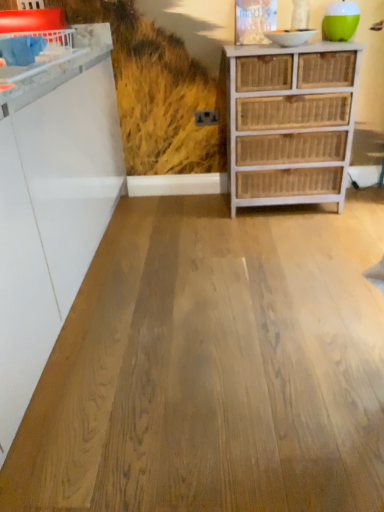
Question: Is white glossy counter at upper left directly adjacent to white wicker chest of drawers at right?

Choices:
 (A) no
 (B) yes

Answer: (A)

Question: Does white glossy counter at upper left come behind white wicker chest of drawers at right?

Choices:
 (A) no
 (B) yes

Answer: (A)

Question: From a real-world perspective, is white glossy counter at upper left physically below white wicker chest of drawers at right?

Choices:
 (A) no
 (B) yes

Answer: (A)

Question: Considering the relative sizes of white glossy counter at upper left and white wicker chest of drawers at right in the image provided, is white glossy counter at upper left smaller than white wicker chest of drawers at right?

Choices:
 (A) yes
 (B) no

Answer: (A)

Question: Could you tell me if white glossy counter at upper left is turned towards white wicker chest of drawers at right?

Choices:
 (A) yes
 (B) no

Answer: (B)

Question: From a real-world perspective, relative to white wicker chest of drawers at right, is natural wood floor at center vertically above or below?

Choices:
 (A) above
 (B) below

Answer: (B)

Question: Considering the positions of natural wood floor at center and white wicker chest of drawers at right in the image, is natural wood floor at center bigger or smaller than white wicker chest of drawers at right?

Choices:
 (A) small
 (B) big

Answer: (A)

Question: From their relative heights in the image, would you say natural wood floor at center is taller or shorter than white wicker chest of drawers at right?

Choices:
 (A) short
 (B) tall

Answer: (A)

Question: Is natural wood floor at center in front of or behind white wicker chest of drawers at right in the image?

Choices:
 (A) behind
 (B) front

Answer: (B)

Question: Considering the positions of white wicker chest of drawers at right and natural wood floor at center in the image, is white wicker chest of drawers at right wider or thinner than natural wood floor at center?

Choices:
 (A) wide
 (B) thin

Answer: (B)

Question: Would you say white wicker chest of drawers at right is to the left or to the right of natural wood floor at center in the picture?

Choices:
 (A) left
 (B) right

Answer: (B)

Question: Considering their positions, is white wicker chest of drawers at right located in front of or behind natural wood floor at center?

Choices:
 (A) front
 (B) behind

Answer: (B)

Question: From a real-world perspective, is white wicker chest of drawers at right physically located above or below natural wood floor at center?

Choices:
 (A) above
 (B) below

Answer: (A)

Question: Looking at the image, does white glossy counter at upper left seem bigger or smaller compared to natural wood floor at center?

Choices:
 (A) small
 (B) big

Answer: (A)

Question: From a real-world perspective, is white glossy counter at upper left physically located above or below natural wood floor at center?

Choices:
 (A) above
 (B) below

Answer: (A)